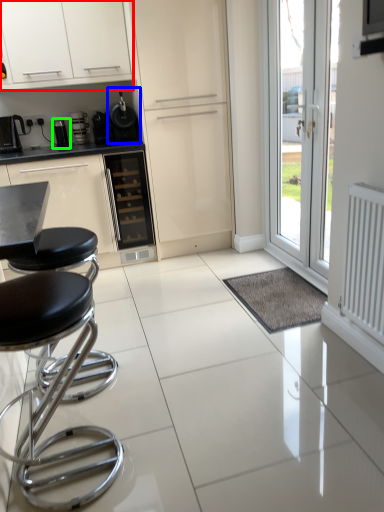
Question: Which object is positioned closest to cabinetry (highlighted by a red box)? Select from appliance (highlighted by a blue box) and appliance (highlighted by a green box).

Choices:
 (A) appliance
 (B) appliance

Answer: (A)